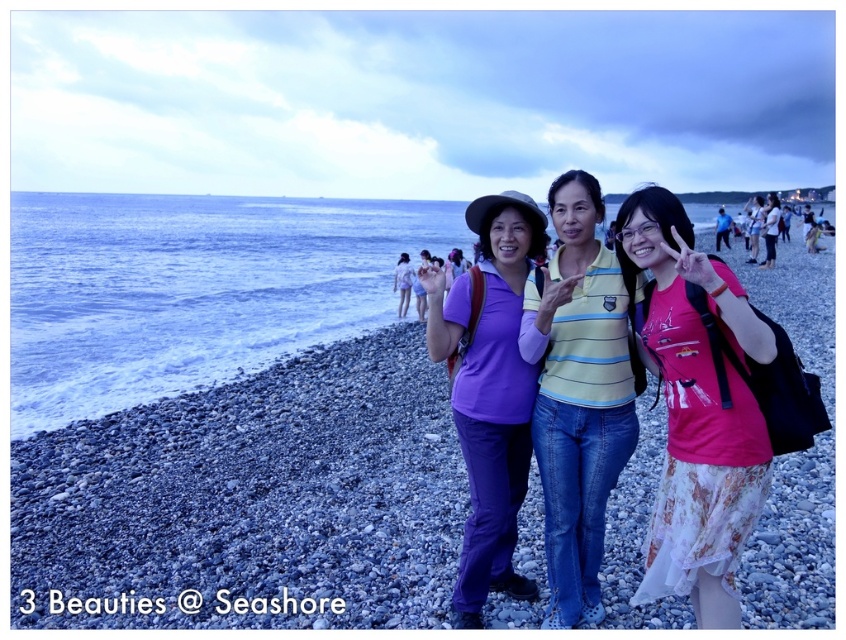
Who is more distant from viewer, (739, 323) or (493, 522)?

The point (493, 522) is behind.

Is point (673, 472) closer to camera compared to point (508, 451)?

Yes, it is.

This screenshot has width=846, height=640. What do you see at coordinates (696, 410) in the screenshot? I see `pink lace skirt at center` at bounding box center [696, 410].

This screenshot has width=846, height=640. I want to click on pink lace skirt at center, so click(696, 410).

Between pebble beach at center and matte purple pants at center, which one appears on the right side from the viewer's perspective?

Positioned to the right is pebble beach at center.

Between point (822, 436) and point (500, 541), which one is positioned in front?

Positioned in front is point (500, 541).

At what (x,y) coordinates should I click in order to perform the action: click on pebble beach at center. Please return your answer as a coordinate pair (x, y). Image resolution: width=846 pixels, height=640 pixels. Looking at the image, I should click on (250, 500).

Is pebble beach at center to the left of pink lace skirt at center from the viewer's perspective?

No, pebble beach at center is not to the left of pink lace skirt at center.

Looking at this image, is pebble beach at center further to the viewer compared to pink lace skirt at center?

Yes, it is.

Who is more distant from viewer, (257, 595) or (677, 456)?

The point (257, 595) is more distant.

Identify the location of pebble beach at center. The image size is (846, 640). (250, 500).